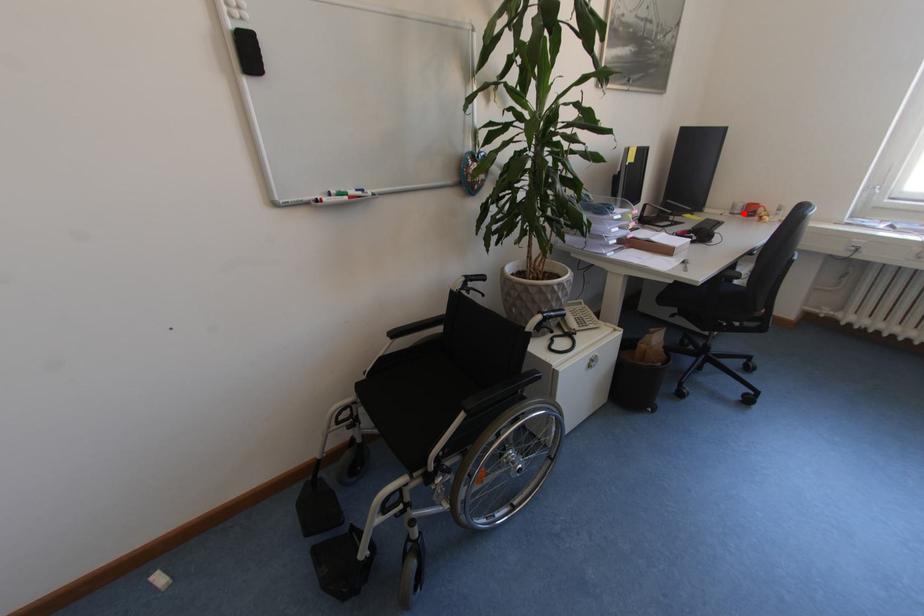
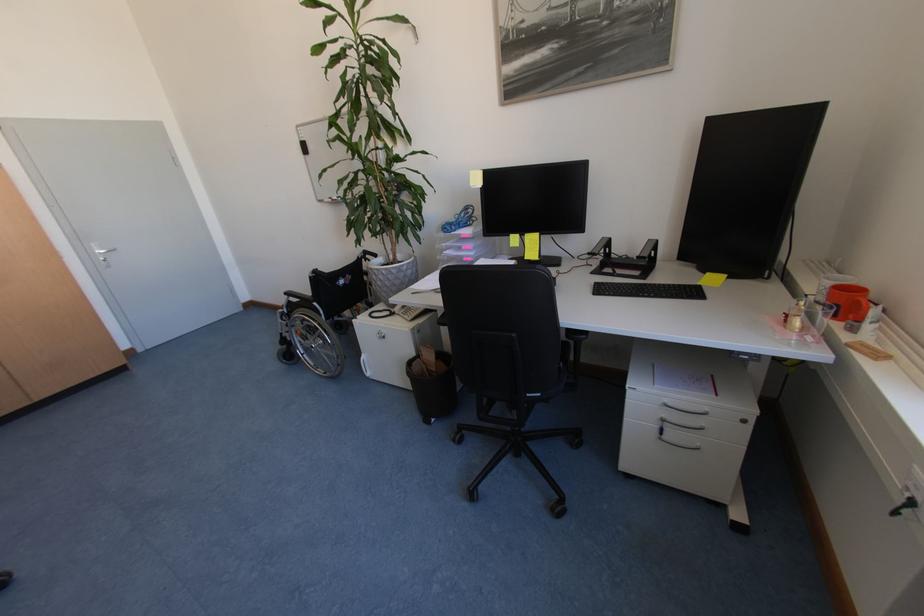
The point at the highlighted location is marked in the first image. Where is the corresponding point in the second image?

(824, 300)